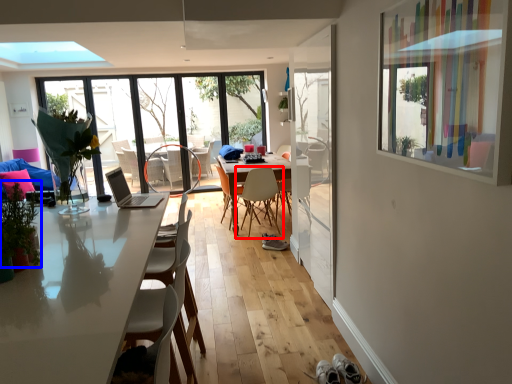
Question: Which object appears farthest to the camera in this image, chair (highlighted by a red box) or plant (highlighted by a blue box)?

Choices:
 (A) chair
 (B) plant

Answer: (A)